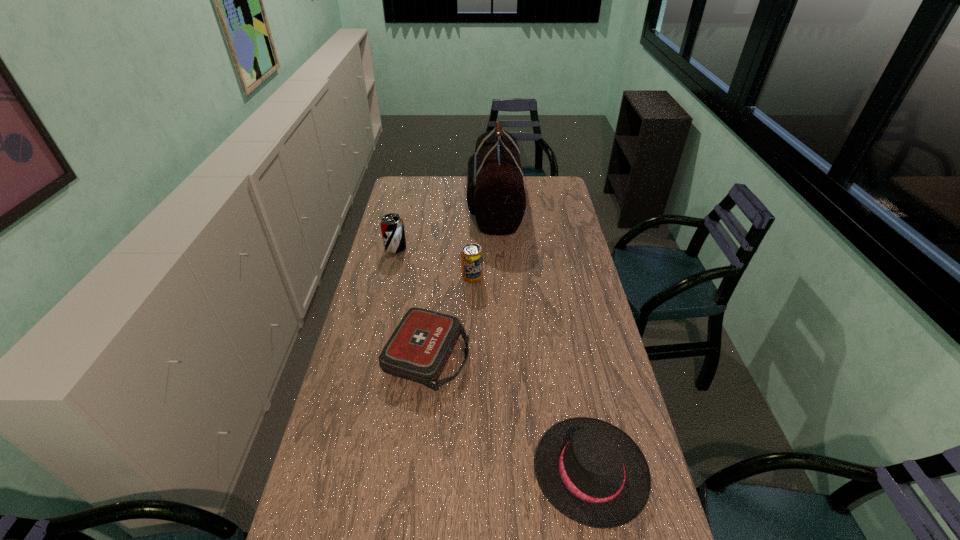
You are a GUI agent. You are given a task and a screenshot of the screen. Output one action in this format:
    pyautogui.click(x=<x>, y=<y>)
    Task: Click on the vacant area that lies between the shortest object and the dress hat
    Image resolution: width=960 pixels, height=540 pixels.
    Given the screenshot: What is the action you would take?
    pyautogui.click(x=509, y=414)

Locate an element on the screen. This screenshot has width=960, height=540. free space that is in between the farthest object and the farther soda can is located at coordinates (444, 226).

Where is `free spot between the dress hat and the first-aid kit`? The width and height of the screenshot is (960, 540). free spot between the dress hat and the first-aid kit is located at coordinates (509, 414).

Image resolution: width=960 pixels, height=540 pixels. I want to click on vacant region between the nearest object and the duffel bag, so click(x=542, y=338).

Select which object appears as the closest to the shortest object. Please provide its 2D coordinates. Your answer should be formatted as a tuple, i.e. [(x, y)], where the tuple contains the x and y coordinates of a point satisfying the conditions above.

[(471, 255)]

In order to click on the fourth closest object relative to the farthest object in this screenshot , I will do `click(591, 471)`.

Locate an element on the screen. blank space that satisfies the following two spatial constraints: 1. on the front side of the dress hat; 2. on the right side of the shortest object is located at coordinates (414, 471).

This screenshot has width=960, height=540. Identify the location of free space that satisfies the following two spatial constraints: 1. on the front pocket of the dress hat; 2. on the right side of the farthest object. (506, 471).

This screenshot has width=960, height=540. I want to click on vacant position in the image that satisfies the following two spatial constraints: 1. on the front side of the nearest object; 2. on the left side of the farther soda can, so click(x=343, y=471).

Where is `vacant space that satisfies the following two spatial constraints: 1. on the front pocket of the dress hat; 2. on the left side of the tallest object`? The image size is (960, 540). vacant space that satisfies the following two spatial constraints: 1. on the front pocket of the dress hat; 2. on the left side of the tallest object is located at coordinates (506, 471).